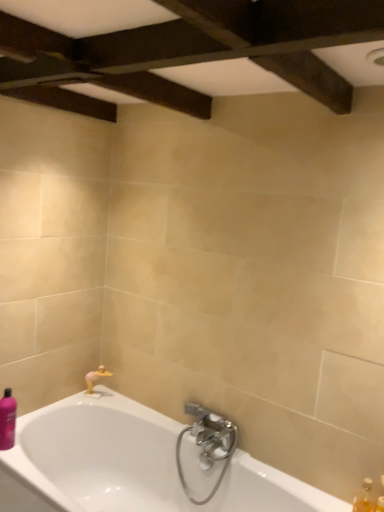
Question: Does translucent plastic soap at lower right, the 2th toiletry in the left-to-right sequence, have a greater width compared to translucent amber bottle at lower right?

Choices:
 (A) yes
 (B) no

Answer: (A)

Question: Is translucent plastic soap at lower right, the 2th toiletry in the left-to-right sequence, at the left side of translucent amber bottle at lower right?

Choices:
 (A) no
 (B) yes

Answer: (A)

Question: Considering the relative positions of translucent plastic soap at lower right, the second toiletry when ordered from top to bottom, and translucent amber bottle at lower right in the image provided, is translucent plastic soap at lower right, the second toiletry when ordered from top to bottom, to the right of translucent amber bottle at lower right from the viewer's perspective?

Choices:
 (A) no
 (B) yes

Answer: (B)

Question: Is translucent plastic soap at lower right, which is the 1th toiletry in front-to-back order, positioned beyond the bounds of translucent amber bottle at lower right?

Choices:
 (A) yes
 (B) no

Answer: (A)

Question: Is the depth of translucent plastic soap at lower right, the first toiletry ordered from the bottom, greater than that of translucent amber bottle at lower right?

Choices:
 (A) yes
 (B) no

Answer: (B)

Question: From the image's perspective, is translucent plastic soap at lower right, the first toiletry ordered from the bottom, over translucent amber bottle at lower right?

Choices:
 (A) no
 (B) yes

Answer: (A)

Question: Can you confirm if purple glossy bottle at lower left, which is counted as the first toiletry, starting from the top, is bigger than translucent plastic soap at lower right, which is the 2th toiletry from back to front?

Choices:
 (A) no
 (B) yes

Answer: (B)

Question: Can you confirm if purple glossy bottle at lower left, placed as the second toiletry when sorted from right to left, is thinner than translucent plastic soap at lower right, which is the 2th toiletry from back to front?

Choices:
 (A) no
 (B) yes

Answer: (A)

Question: Is purple glossy bottle at lower left, acting as the 2th toiletry starting from the bottom, far from translucent plastic soap at lower right, arranged as the first toiletry when viewed from the right?

Choices:
 (A) yes
 (B) no

Answer: (A)

Question: Is purple glossy bottle at lower left, the 1th toiletry in the back-to-front sequence, positioned behind translucent plastic soap at lower right, which is the 1th toiletry in front-to-back order?

Choices:
 (A) no
 (B) yes

Answer: (B)

Question: Would you say purple glossy bottle at lower left, placed as the second toiletry when sorted from right to left, is outside translucent plastic soap at lower right, which is the 2th toiletry from back to front?

Choices:
 (A) yes
 (B) no

Answer: (A)

Question: Considering the relative sizes of purple glossy bottle at lower left, the 1th toiletry in the back-to-front sequence, and translucent plastic soap at lower right, which is the 2th toiletry from back to front, in the image provided, is purple glossy bottle at lower left, the 1th toiletry in the back-to-front sequence, shorter than translucent plastic soap at lower right, which is the 2th toiletry from back to front,?

Choices:
 (A) yes
 (B) no

Answer: (B)

Question: Are white glossy bathtub at lower left and translucent plastic soap at lower right, the second toiletry when ordered from top to bottom, far apart?

Choices:
 (A) yes
 (B) no

Answer: (A)